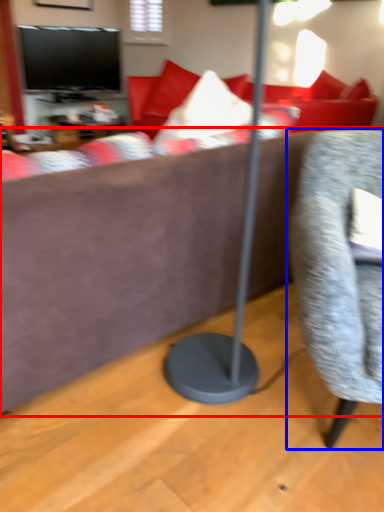
Question: Which object is closer to the camera taking this photo, studio couch (highlighted by a red box) or chair (highlighted by a blue box)?

Choices:
 (A) studio couch
 (B) chair

Answer: (B)